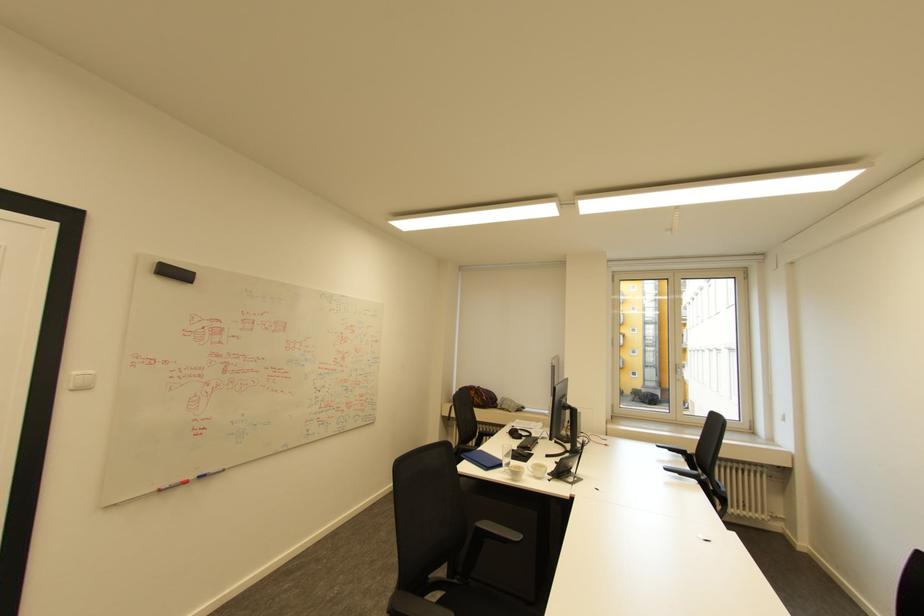
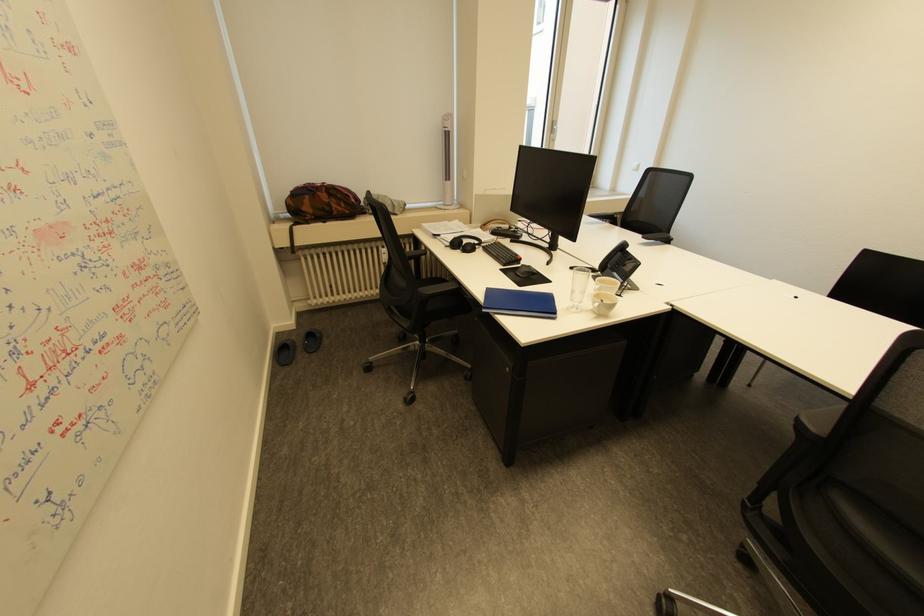
Locate, in the second image, the point that corresponds to (478,391) in the first image.

(324, 193)